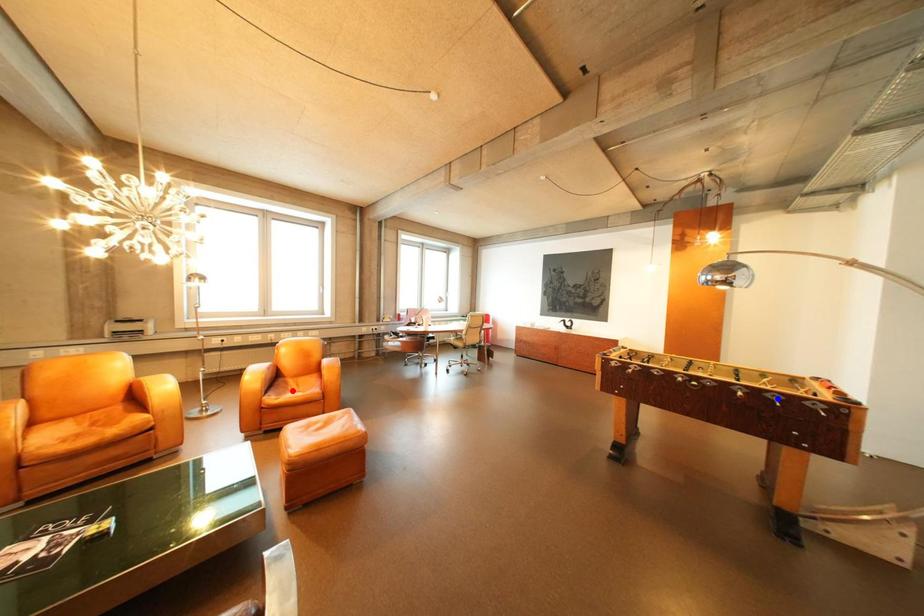
Question: Two points are marked on the image. Which point is closer to the camera?

Choices:
 (A) Blue point is closer.
 (B) Red point is closer.

Answer: (A)